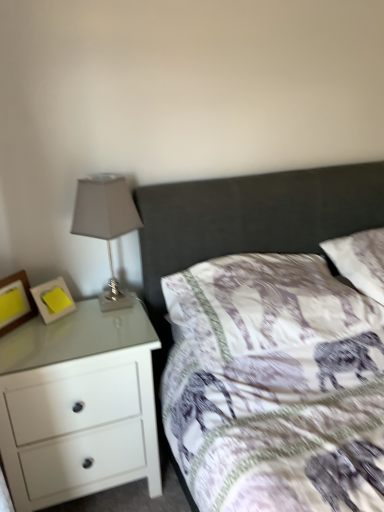
Question: Is matte gray glass table lamp at left surrounding white glossy chest of drawers at left?

Choices:
 (A) yes
 (B) no

Answer: (B)

Question: Can you confirm if matte gray glass table lamp at left is bigger than white glossy chest of drawers at left?

Choices:
 (A) yes
 (B) no

Answer: (B)

Question: Does matte gray glass table lamp at left have a greater width compared to white glossy chest of drawers at left?

Choices:
 (A) no
 (B) yes

Answer: (A)

Question: Can you confirm if matte gray glass table lamp at left is taller than white glossy chest of drawers at left?

Choices:
 (A) no
 (B) yes

Answer: (A)

Question: Is white glossy chest of drawers at left at the back of matte gray glass table lamp at left?

Choices:
 (A) no
 (B) yes

Answer: (A)

Question: Would you say matte gray glass table lamp at left is inside or outside white fabric pillow at center, the first pillow positioned from the left?

Choices:
 (A) inside
 (B) outside

Answer: (B)

Question: Based on their sizes in the image, would you say matte gray glass table lamp at left is bigger or smaller than white fabric pillow at center, placed as the 2th pillow when sorted from right to left?

Choices:
 (A) small
 (B) big

Answer: (A)

Question: Is matte gray glass table lamp at left in front of or behind white fabric pillow at center, placed as the 2th pillow when sorted from right to left, in the image?

Choices:
 (A) front
 (B) behind

Answer: (B)

Question: From a real-world perspective, is matte gray glass table lamp at left positioned above or below white fabric pillow at center, the first pillow positioned from the left?

Choices:
 (A) above
 (B) below

Answer: (A)

Question: Considering their positions, is white soft pillow at upper right, acting as the 1th pillow starting from the right, located in front of or behind matte gray glass table lamp at left?

Choices:
 (A) behind
 (B) front

Answer: (A)

Question: In terms of size, does white soft pillow at upper right, which appears as the second pillow when viewed from the left, appear bigger or smaller than matte gray glass table lamp at left?

Choices:
 (A) big
 (B) small

Answer: (A)

Question: Is point (380, 280) closer or farther from the camera than point (132, 220)?

Choices:
 (A) closer
 (B) farther

Answer: (B)

Question: Considering the positions of white soft pillow at upper right, which appears as the second pillow when viewed from the left, and matte gray glass table lamp at left in the image, is white soft pillow at upper right, which appears as the second pillow when viewed from the left, wider or thinner than matte gray glass table lamp at left?

Choices:
 (A) wide
 (B) thin

Answer: (A)

Question: In terms of width, does white glossy chest of drawers at left look wider or thinner when compared to wooden picture frame at left, which is counted as the 2th picture frame, starting from the right?

Choices:
 (A) wide
 (B) thin

Answer: (A)

Question: Considering the relative positions of white glossy chest of drawers at left and wooden picture frame at left, marked as the first picture frame in a left-to-right arrangement, in the image provided, is white glossy chest of drawers at left to the left or to the right of wooden picture frame at left, marked as the first picture frame in a left-to-right arrangement,?

Choices:
 (A) right
 (B) left

Answer: (A)